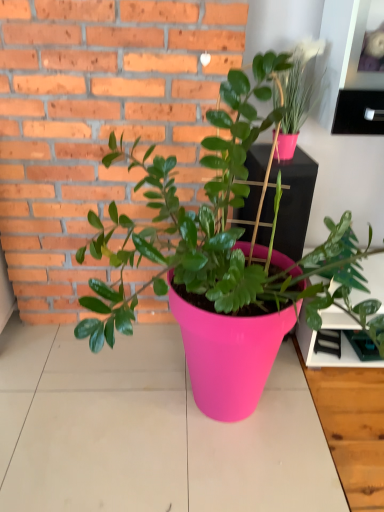
Question: From a real-world perspective, is pink plastic shelf at upper right physically below pink plastic table top at center?

Choices:
 (A) no
 (B) yes

Answer: (A)

Question: Is pink plastic shelf at upper right positioned far away from pink plastic table top at center?

Choices:
 (A) yes
 (B) no

Answer: (A)

Question: From the image's perspective, is pink plastic shelf at upper right over pink plastic table top at center?

Choices:
 (A) no
 (B) yes

Answer: (B)

Question: Is the surface of pink plastic shelf at upper right in direct contact with pink plastic table top at center?

Choices:
 (A) no
 (B) yes

Answer: (A)

Question: Does pink plastic shelf at upper right have a lesser width compared to pink plastic table top at center?

Choices:
 (A) no
 (B) yes

Answer: (B)

Question: Considering the relative sizes of pink plastic shelf at upper right and pink plastic table top at center in the image provided, is pink plastic shelf at upper right wider than pink plastic table top at center?

Choices:
 (A) no
 (B) yes

Answer: (A)

Question: Does matte pink pot at upper right, positioned as the 2th houseplant in left-to-right order, have a greater width compared to pink plastic pot at center, acting as the 2th houseplant starting from the right?

Choices:
 (A) no
 (B) yes

Answer: (A)

Question: From a real-world perspective, is matte pink pot at upper right, positioned as the 2th houseplant in left-to-right order, positioned over pink plastic pot at center, acting as the 2th houseplant starting from the right, based on gravity?

Choices:
 (A) yes
 (B) no

Answer: (A)

Question: Can you confirm if matte pink pot at upper right, positioned as the 2th houseplant in left-to-right order, is bigger than pink plastic pot at center, the 1th houseplant viewed from the left?

Choices:
 (A) no
 (B) yes

Answer: (A)

Question: Is matte pink pot at upper right, which is counted as the first houseplant, starting from the right, facing towards pink plastic pot at center, the 1th houseplant viewed from the left?

Choices:
 (A) no
 (B) yes

Answer: (B)

Question: Is matte pink pot at upper right, positioned as the 2th houseplant in left-to-right order, far from pink plastic pot at center, the 1th houseplant viewed from the left?

Choices:
 (A) yes
 (B) no

Answer: (B)

Question: Considering the relative sizes of matte pink pot at upper right, which is counted as the first houseplant, starting from the right, and pink plastic pot at center, acting as the 2th houseplant starting from the right, in the image provided, is matte pink pot at upper right, which is counted as the first houseplant, starting from the right, smaller than pink plastic pot at center, acting as the 2th houseplant starting from the right,?

Choices:
 (A) yes
 (B) no

Answer: (A)

Question: Can you confirm if pink plastic pot at center, acting as the 2th houseplant starting from the right, is thinner than matte pink pot at upper right, positioned as the 2th houseplant in left-to-right order?

Choices:
 (A) no
 (B) yes

Answer: (A)